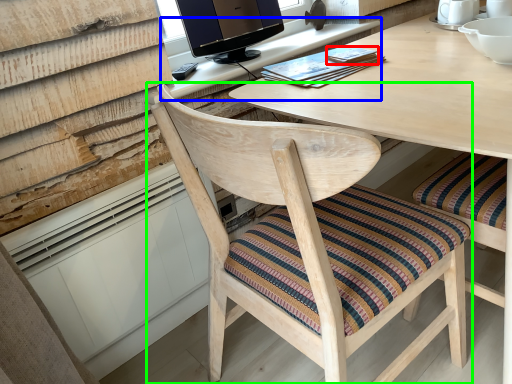
Question: Estimate the real-world distances between objects in this image. Which object is farther from book (highlighted by a red box), computer desk (highlighted by a blue box) or chair (highlighted by a green box)?

Choices:
 (A) computer desk
 (B) chair

Answer: (B)